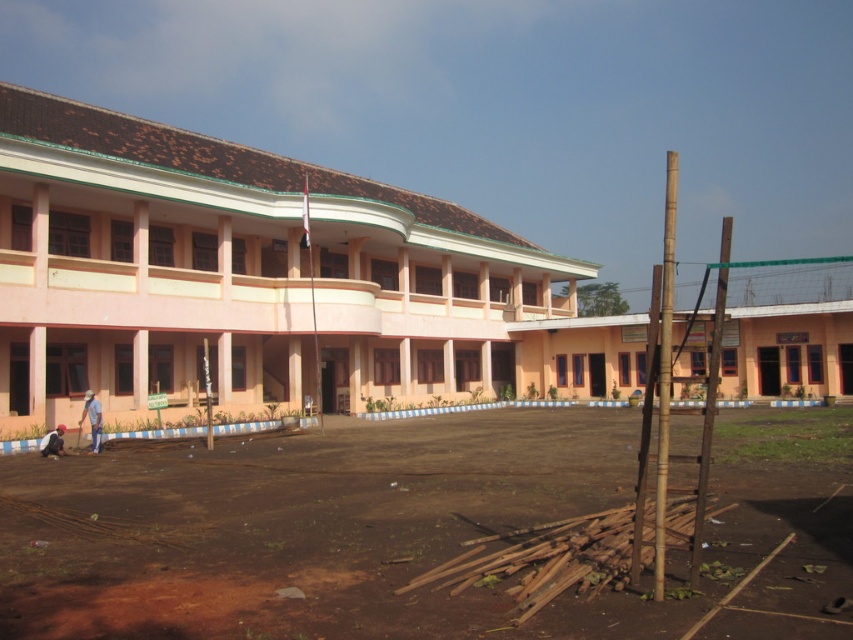
Looking at this image, between brown dirt field at center and light brown straw hat at lower left, which one has more height?

light brown straw hat at lower left

Does point (759, 529) come behind point (85, 404)?

That is False.

Is point (463, 420) farther from viewer compared to point (97, 419)?

Yes, it is behind point (97, 419).

At what (x,y) coordinates should I click in order to perform the action: click on brown dirt field at center. Please return your answer as a coordinate pair (x, y). The image size is (853, 640). Looking at the image, I should click on (401, 531).

Can you confirm if light brown straw hat at lower left is wider than dark blue jeans at lower left?

Incorrect, light brown straw hat at lower left's width does not surpass dark blue jeans at lower left's.

Does light brown straw hat at lower left appear on the right side of dark blue jeans at lower left?

Indeed, light brown straw hat at lower left is positioned on the right side of dark blue jeans at lower left.

Identify the location of light brown straw hat at lower left. The image size is (853, 640). (91, 419).

Who is higher up, brown dirt field at center or dark blue jeans at lower left?

brown dirt field at center is above.

Is point (306, 499) positioned after point (42, 449)?

No, it is not.

Which is behind, point (256, 451) or point (44, 435)?

Point (44, 435)

At what (x,y) coordinates should I click in order to perform the action: click on brown dirt field at center. Please return your answer as a coordinate pair (x, y). The width and height of the screenshot is (853, 640). Looking at the image, I should click on (401, 531).